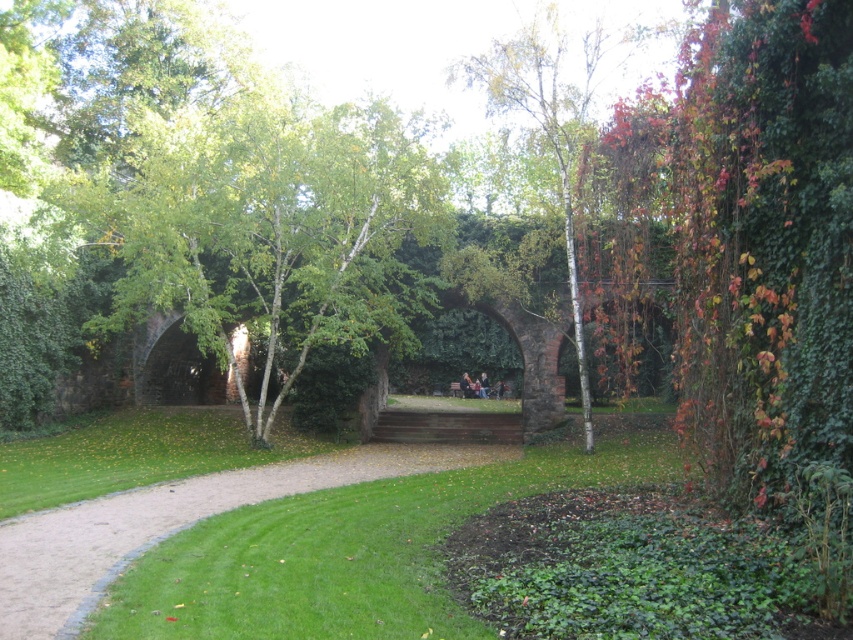
Question: Is green leafy tree at center bigger than white bark tree at center?

Choices:
 (A) no
 (B) yes

Answer: (B)

Question: Which point is closer to the camera?

Choices:
 (A) green grass at center
 (B) green leafy tree at center
 (C) white bark tree at center

Answer: (A)

Question: Does green leafy tree at center appear on the left side of white bark tree at center?

Choices:
 (A) yes
 (B) no

Answer: (A)

Question: From the image, what is the correct spatial relationship of green leafy tree at center in relation to green grass at center?

Choices:
 (A) below
 (B) above

Answer: (B)

Question: Which point is closer to the camera taking this photo?

Choices:
 (A) (567, 193)
 (B) (262, 582)

Answer: (B)

Question: Considering the real-world distances, which object is closest to the white bark tree at center?

Choices:
 (A) green grass at center
 (B) green leafy tree at center

Answer: (B)